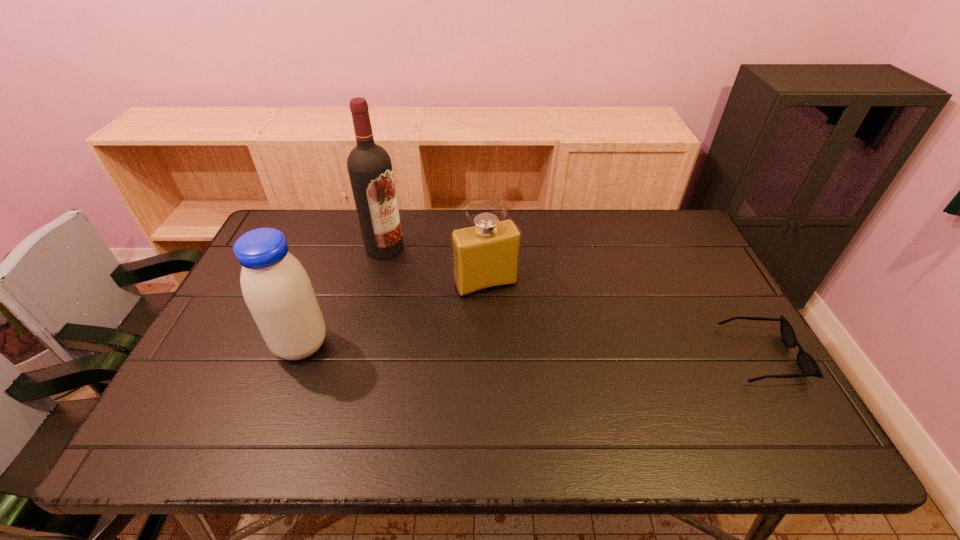
The width and height of the screenshot is (960, 540). I want to click on the third shortest object, so click(x=277, y=290).

At what (x,y) coordinates should I click in order to perform the action: click on the leftmost object. Please return your answer as a coordinate pair (x, y). Looking at the image, I should click on (277, 290).

The image size is (960, 540). Find the location of `the shortest object`. the shortest object is located at coordinates (806, 362).

The image size is (960, 540). Find the location of `sunglasses`. sunglasses is located at coordinates (806, 362).

This screenshot has height=540, width=960. I want to click on the third tallest object, so click(485, 256).

Where is `perfume`? This screenshot has width=960, height=540. perfume is located at coordinates (485, 256).

I want to click on the tallest object, so click(x=369, y=166).

This screenshot has height=540, width=960. In order to click on the third object from right to left in this screenshot , I will do `click(369, 166)`.

Image resolution: width=960 pixels, height=540 pixels. Identify the location of free space located 0.100m on the right of the soya milk. (368, 345).

At what (x,y) coordinates should I click in order to perform the action: click on vacant space located 0.270m on the front-facing side of the perfume. Please return your answer as a coordinate pair (x, y). The image size is (960, 540). Looking at the image, I should click on (534, 374).